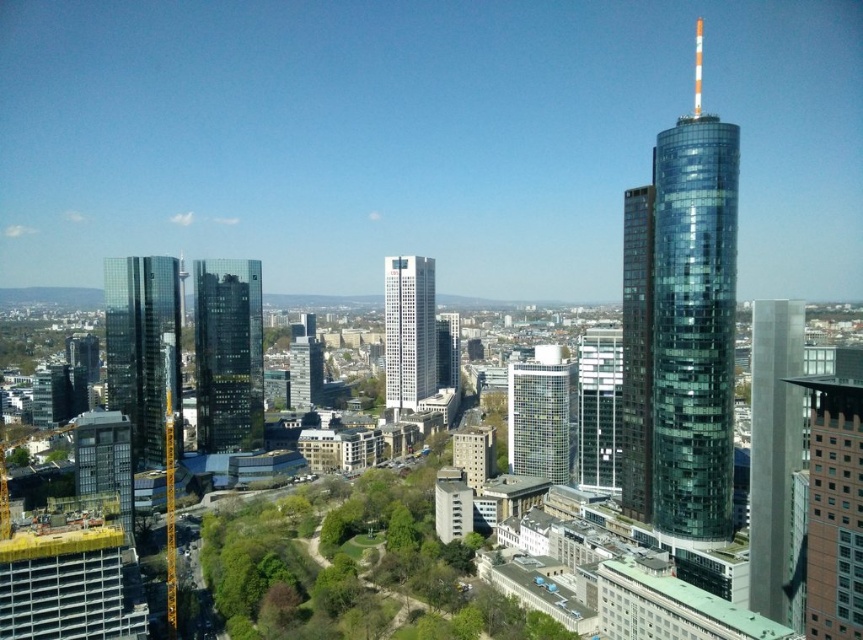
You are an urban planner assessing the city layout. You need to determine which of the two buildings, the brown brick building at right or the glassy reflective skyscraper at center, has a greater width. Based on the scene, which one is wider?

The brown brick building at right is wider than the glassy reflective skyscraper at center because its width surpasses that of the glassy reflective skyscraper at center according to the description.

You are a city planner assessing the distance between the brown brick building at right and the glassy reflective skyscraper at center. Given that the minimum required distance for safety regulations is 70 meters, can the current spacing between them comply with the regulations?

The brown brick building at right is 69.48 meters away from the glassy reflective skyscraper at center, which is less than the required 70 meters for safety regulations. Therefore, the current spacing does not comply with the regulations.